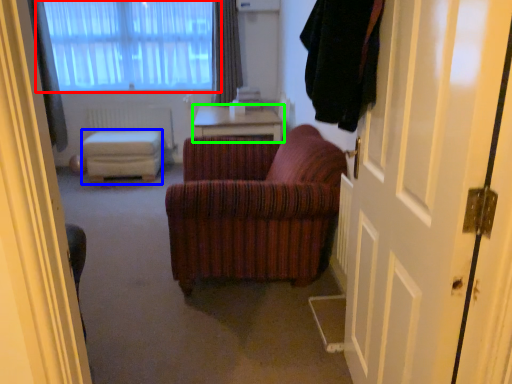
Question: Which is farther away from window (highlighted by a red box)? stool (highlighted by a blue box) or table (highlighted by a green box)?

Choices:
 (A) stool
 (B) table

Answer: (B)